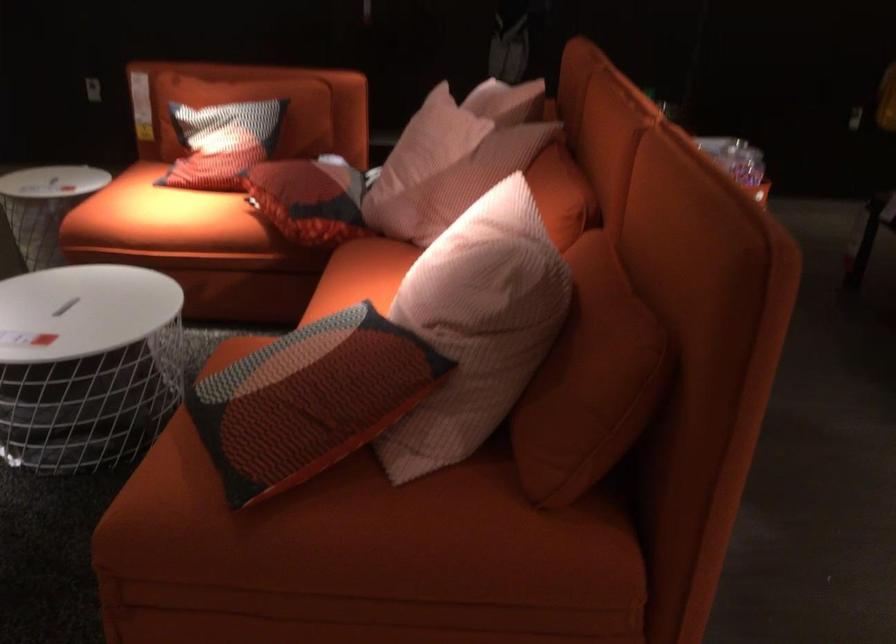
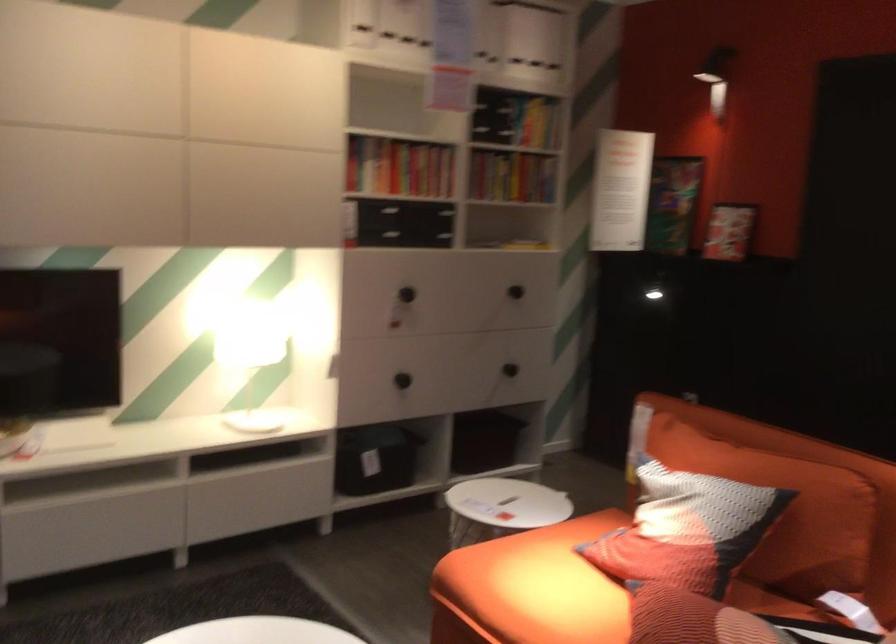
Locate, in the second image, the point that corresponds to point (242, 142) in the first image.

(686, 529)